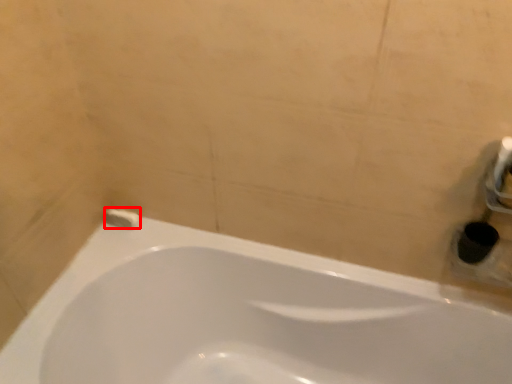
Question: Where is toilet paper (annotated by the red box) located in relation to bathtub in the image?

Choices:
 (A) left
 (B) right

Answer: (A)